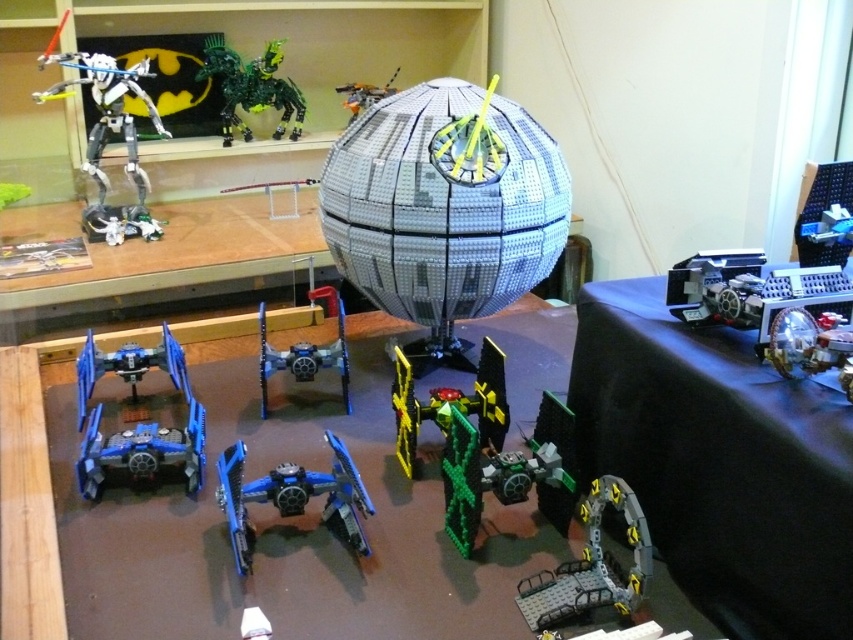
Which is below, yellow-green plastic robot at center or blue metallic spaceship at center?

yellow-green plastic robot at center

Which is in front, point (498, 358) or point (335, 294)?

Positioned in front is point (498, 358).

What are the coordinates of `yellow-green plastic robot at center` in the screenshot? It's located at [x=450, y=404].

Is blue plastic spaceship at center below yellow-green plastic robot at center?

Yes, blue plastic spaceship at center is below yellow-green plastic robot at center.

Is blue plastic spaceship at center further to the viewer compared to yellow-green plastic robot at center?

No, it is not.

Between point (321, 486) and point (402, 368), which one is positioned in front?

Point (321, 486)

Locate an element on the screen. blue plastic spaceship at center is located at coordinates (292, 497).

Is blue plastic fighter jet at lower left positioned before green matte/brushed spaceship at center?

No, it is behind green matte/brushed spaceship at center.

Between point (85, 429) and point (554, 468), which one is positioned behind?

The point (85, 429) is behind.

The width and height of the screenshot is (853, 640). Describe the element at coordinates (138, 422) in the screenshot. I see `blue plastic fighter jet at lower left` at that location.

Find the location of `blue plastic fighter jet at lower left`. blue plastic fighter jet at lower left is located at coordinates (138, 422).